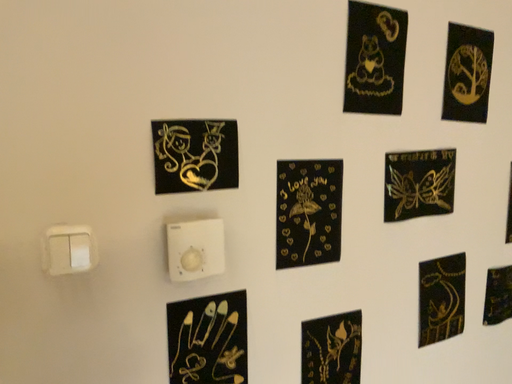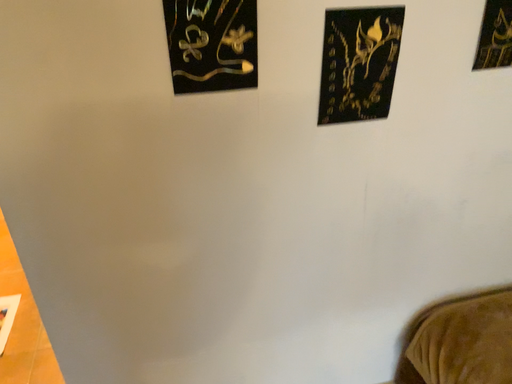
Question: How did the camera likely rotate when shooting the video?

Choices:
 (A) rotated right
 (B) rotated left

Answer: (B)